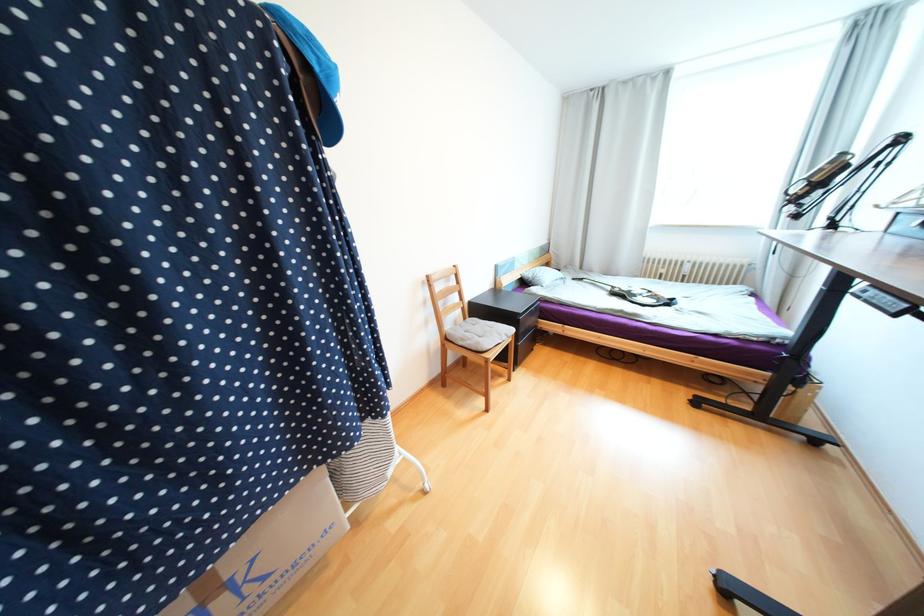
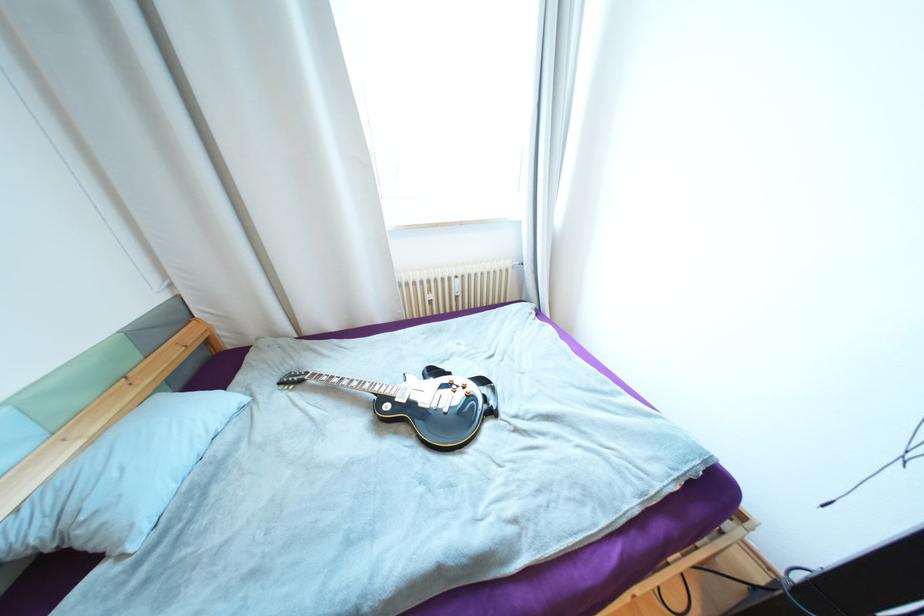
The point at (689, 276) is marked in the first image. Where is the corresponding point in the second image?

(463, 297)